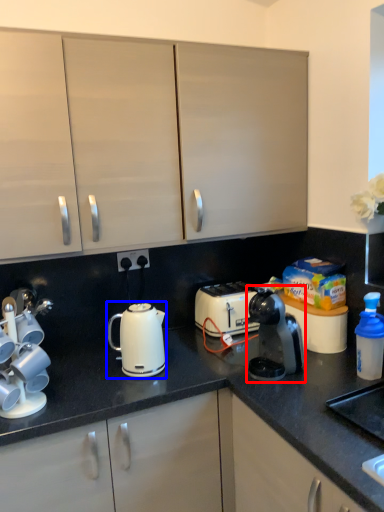
Question: Which point is closer to the camera, home appliance (highlighted by a red box) or kettle (highlighted by a blue box)?

Choices:
 (A) home appliance
 (B) kettle

Answer: (A)